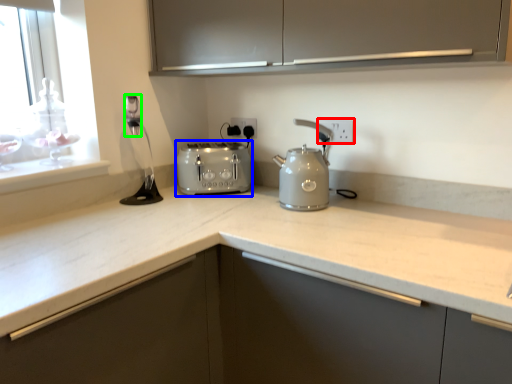
Question: Which object is positioned closest to electric outlet (highlighted by a red box)? Select from toaster (highlighted by a blue box) and faucet (highlighted by a green box).

Choices:
 (A) toaster
 (B) faucet

Answer: (A)